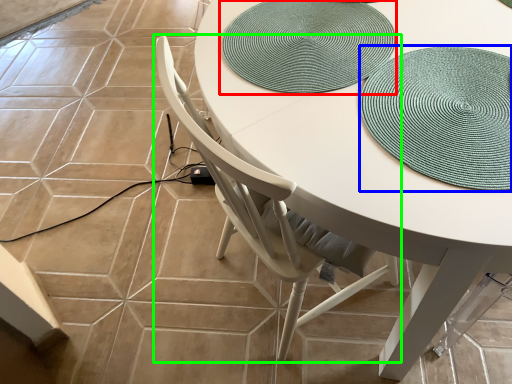
Question: Which object is positioned closest to mat (highlighted by a red box)? Select from hat (highlighted by a blue box) and chair (highlighted by a green box).

Choices:
 (A) hat
 (B) chair

Answer: (A)